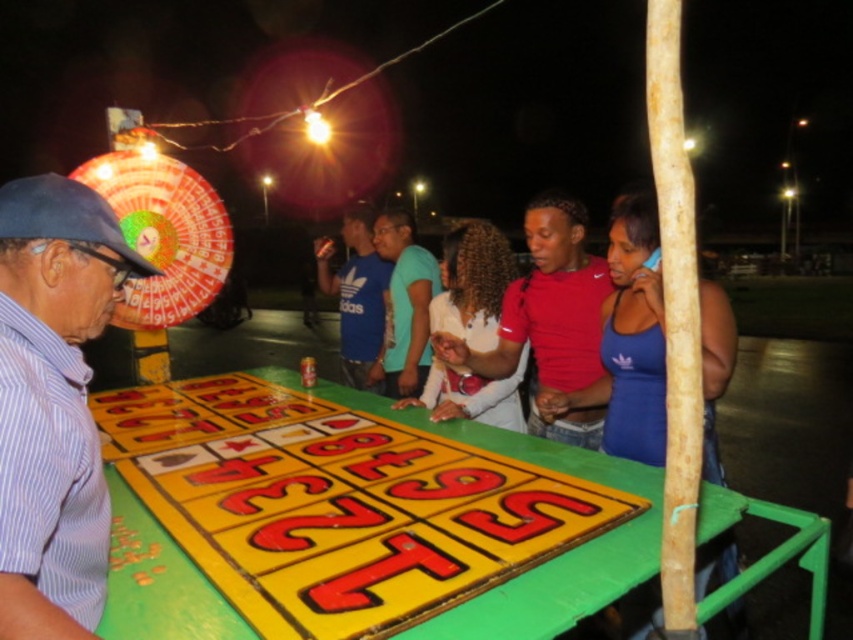
In the scene shown: Can you confirm if striped cotton shirt at left is bigger than teal matte shirt at center?

No.

Does striped cotton shirt at left have a smaller size compared to teal matte shirt at center?

Yes, striped cotton shirt at left is smaller than teal matte shirt at center.

Who is more distant from viewer, (x=84, y=266) or (x=399, y=378)?

Positioned behind is point (x=399, y=378).

Locate an element on the screen. striped cotton shirt at left is located at coordinates (53, 403).

Is striped cotton shirt at left below yellow painted wood table at center?

No.

Is striped cotton shirt at left taller than yellow painted wood table at center?

Yes, striped cotton shirt at left is taller than yellow painted wood table at center.

Is point (96, 259) closer to camera compared to point (492, 588)?

Yes, it is.

You are a GUI agent. You are given a task and a screenshot of the screen. Output one action in this format:
    pyautogui.click(x=<x>, y=<y>)
    Task: Click on the striped cotton shirt at left
    This screenshot has height=640, width=853.
    Given the screenshot: What is the action you would take?
    pyautogui.click(x=53, y=403)

Which is behind, point (648, 536) or point (334, 284)?

The point (334, 284) is behind.

Who is more forward, (x=438, y=432) or (x=357, y=371)?

Point (x=438, y=432) is in front.

This screenshot has height=640, width=853. I want to click on yellow painted wood table at center, so click(x=550, y=560).